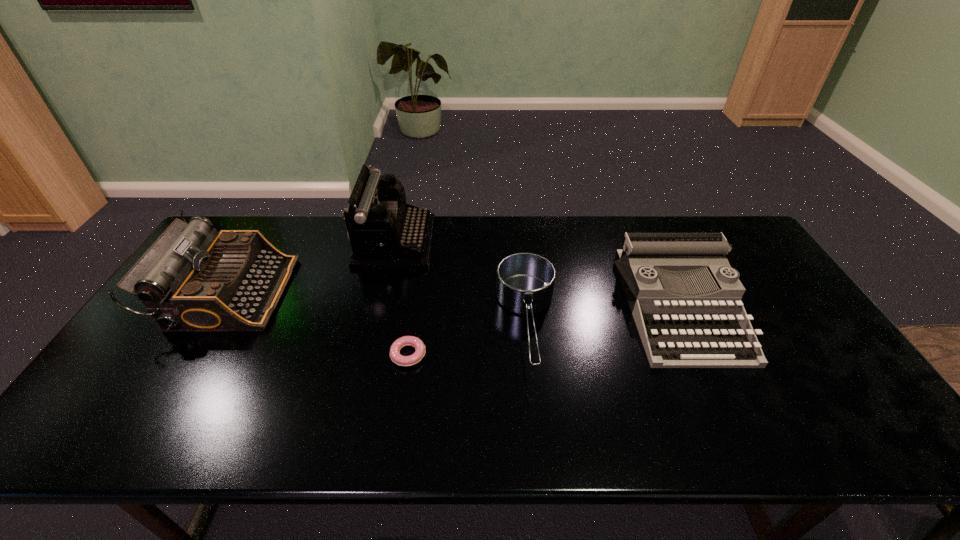
Identify which object is the closest to the shortest typewriter. Please provide its 2D coordinates. Your answer should be formatted as a tuple, i.e. [(x, y)], where the tuple contains the x and y coordinates of a point satisfying the conditions above.

[(525, 281)]

Find the location of a particular element. The image size is (960, 540). typewriter that is the closest one to the fourth tallest object is located at coordinates (711, 329).

You are a GUI agent. You are given a task and a screenshot of the screen. Output one action in this format:
    pyautogui.click(x=<x>, y=<y>)
    Task: Click on the typewriter object that ranks as the second closest to the rightmost typewriter
    Image resolution: width=960 pixels, height=540 pixels.
    Given the screenshot: What is the action you would take?
    pyautogui.click(x=192, y=279)

At what (x,y) coordinates should I click in order to perform the action: click on free space that satisfies the following two spatial constraints: 1. on the typing side of the tallest typewriter; 2. on the left side of the doughnut. Please return your answer as a coordinate pair (x, y). Looking at the image, I should click on (369, 355).

The image size is (960, 540). Find the location of `vacant space that satisfies the following two spatial constraints: 1. on the typing side of the tallest object; 2. on the right side of the doughnut`. vacant space that satisfies the following two spatial constraints: 1. on the typing side of the tallest object; 2. on the right side of the doughnut is located at coordinates (369, 355).

The image size is (960, 540). What are the coordinates of `vacant space that satisfies the following two spatial constraints: 1. on the typing side of the second typewriter from left to right; 2. on the left side of the doughnut` in the screenshot? It's located at (369, 355).

Image resolution: width=960 pixels, height=540 pixels. I want to click on vacant area that satisfies the following two spatial constraints: 1. on the typing side of the shortest object; 2. on the right side of the second typewriter from right to left, so click(x=369, y=355).